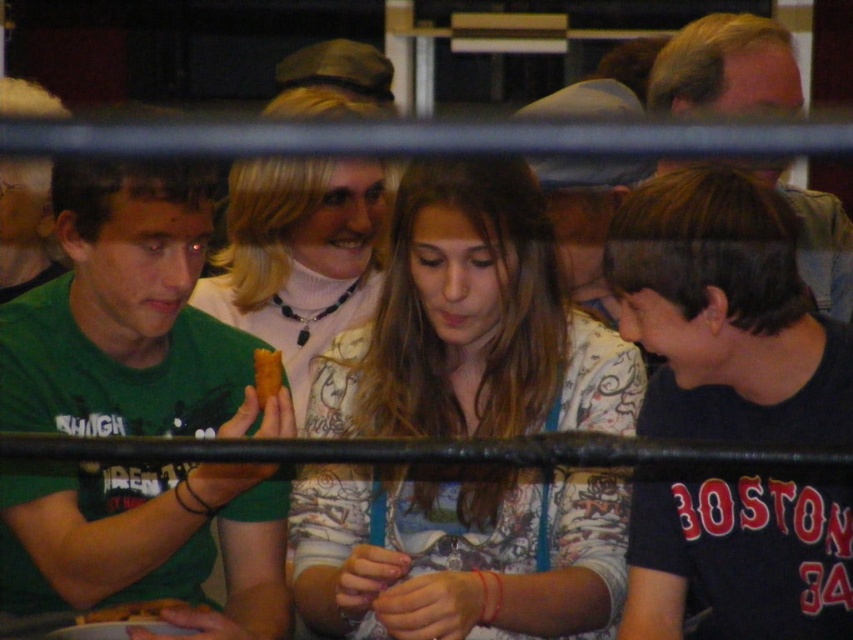
Is black matte shirt at lower right bigger than yellow matte bread at center?

Indeed, black matte shirt at lower right has a larger size compared to yellow matte bread at center.

Between black matte shirt at lower right and yellow matte bread at center, which one has more height?

black matte shirt at lower right is taller.

The image size is (853, 640). Find the location of `black matte shirt at lower right`. black matte shirt at lower right is located at coordinates (726, 314).

Can you confirm if floral-patterned blouse at center is thinner than yellow matte bread at center?

No.

Which of these two, floral-patterned blouse at center or yellow matte bread at center, stands taller?

With more height is floral-patterned blouse at center.

Which is behind, point (386, 534) or point (254, 369)?

The point (386, 534) is behind.

The image size is (853, 640). I want to click on floral-patterned blouse at center, so click(473, 324).

Which is above, black matte shirt at lower right or golden crispy pastry at lower left?

black matte shirt at lower right is above.

The image size is (853, 640). I want to click on black matte shirt at lower right, so click(726, 314).